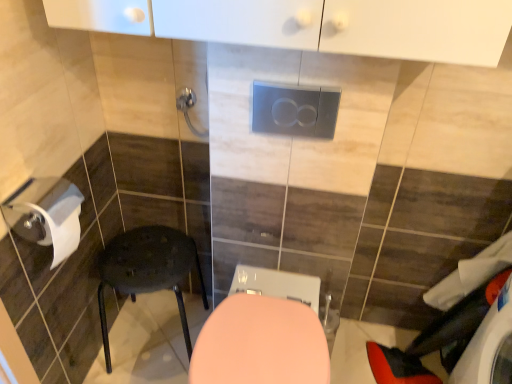
This screenshot has height=384, width=512. Find the location of `free location above pink glossy toilet at center (from a real-world perspective)`. free location above pink glossy toilet at center (from a real-world perspective) is located at coordinates (264, 338).